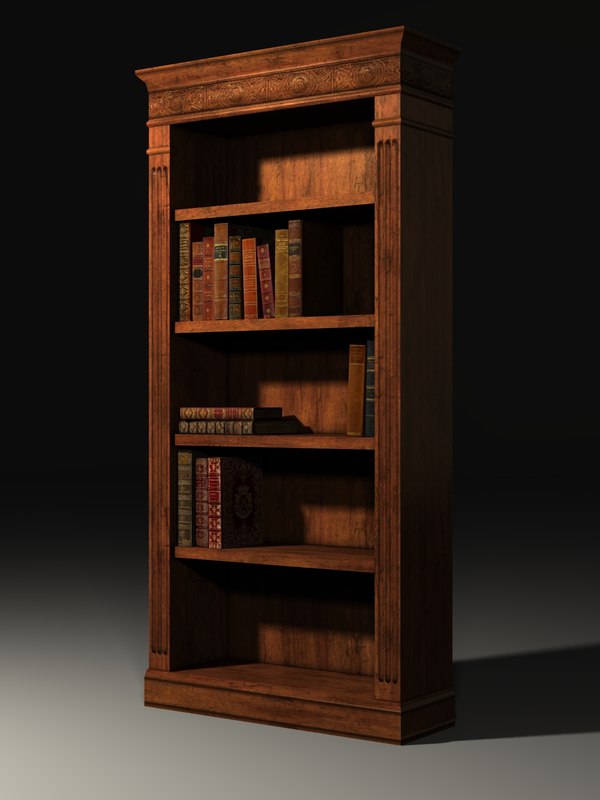
You are a GUI agent. You are given a task and a screenshot of the screen. Output one action in this format:
    pyautogui.click(x=<x>, y=<y>)
    Task: Click on the white floor
    The width and height of the screenshot is (600, 800).
    Given the screenshot: What is the action you would take?
    pyautogui.click(x=240, y=773)